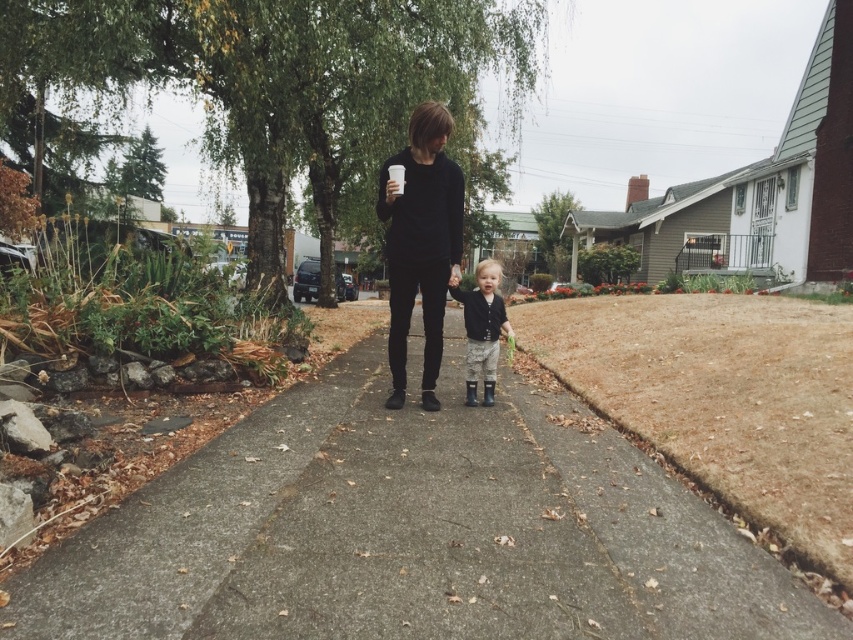
Question: Among these objects, which one is farthest from the camera?

Choices:
 (A) matte black jacket at center
 (B) concrete at center
 (C) black matte/black pants at center

Answer: (A)

Question: Is concrete at center closer to the viewer compared to matte black jacket at center?

Choices:
 (A) yes
 (B) no

Answer: (A)

Question: Is concrete at center wider than matte black jacket at center?

Choices:
 (A) no
 (B) yes

Answer: (B)

Question: Does concrete at center have a greater width compared to black matte/black pants at center?

Choices:
 (A) yes
 (B) no

Answer: (A)

Question: Among these objects, which one is nearest to the camera?

Choices:
 (A) matte black jacket at center
 (B) black matte/black pants at center
 (C) concrete at center

Answer: (C)

Question: Which object is positioned farthest from the matte black jacket at center?

Choices:
 (A) concrete at center
 (B) black matte/black pants at center

Answer: (A)